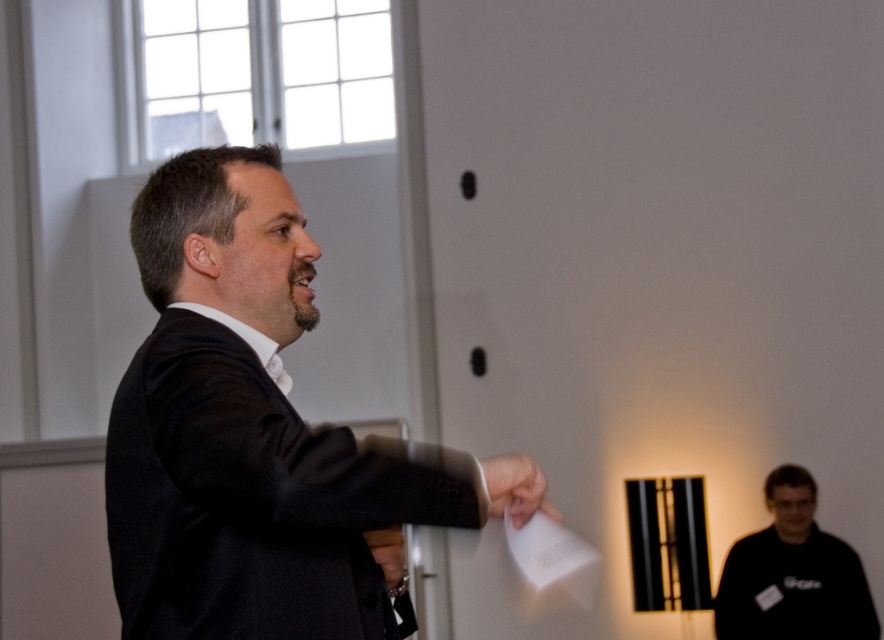
Question: Among these objects, which one is nearest to the camera?

Choices:
 (A) black matte suit at center
 (B) black matte shirt at lower right
 (C) white paper at center
 (D) matte black hand at center

Answer: (A)

Question: Is black matte suit at center below black matte shirt at lower right?

Choices:
 (A) no
 (B) yes

Answer: (A)

Question: In this image, where is black matte suit at center located relative to matte black hand at center?

Choices:
 (A) above
 (B) below

Answer: (A)

Question: Can you confirm if black matte suit at center is wider than black matte shirt at lower right?

Choices:
 (A) yes
 (B) no

Answer: (B)

Question: Which object is closer to the camera taking this photo?

Choices:
 (A) matte black hand at center
 (B) white paper at center
 (C) black matte shirt at lower right

Answer: (A)

Question: Which object appears closest to the camera in this image?

Choices:
 (A) white paper at center
 (B) matte black hand at center
 (C) black matte suit at center

Answer: (C)